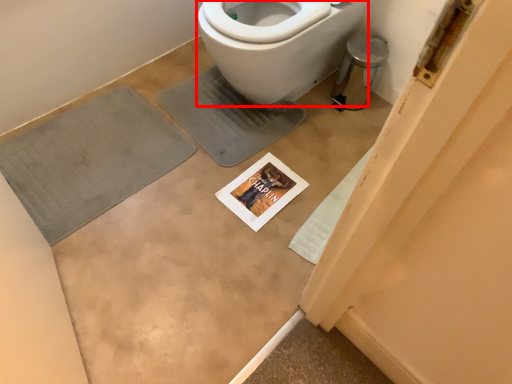
Question: From the image's perspective, where is bidet (annotated by the red box) located relative to bath mat?

Choices:
 (A) above
 (B) below

Answer: (A)